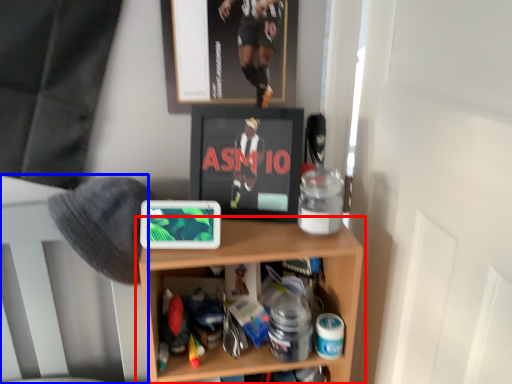
Question: Which of the following is the farthest to the observer, shelf (highlighted by a red box) or bed frame (highlighted by a blue box)?

Choices:
 (A) shelf
 (B) bed frame

Answer: (B)